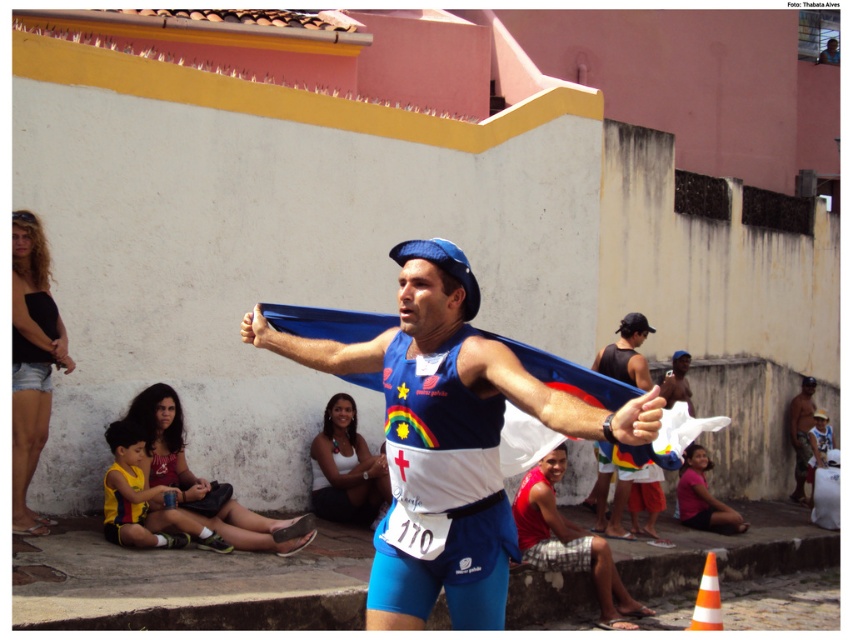
You are a photographer standing in the middle of the street. You want to take a photo of the blue fabric flag at center and the orange striped traffic cone at lower right. Which object will appear larger in your photo?

The blue fabric flag at center will appear larger in the photo because it is closer to the viewer than the orange striped traffic cone at lower right.